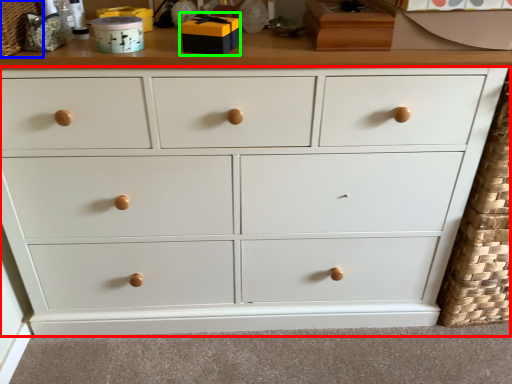
Question: Which is farther away from chest of drawers (highlighted by a red box)? basket (highlighted by a blue box) or toy (highlighted by a green box)?

Choices:
 (A) basket
 (B) toy

Answer: (A)